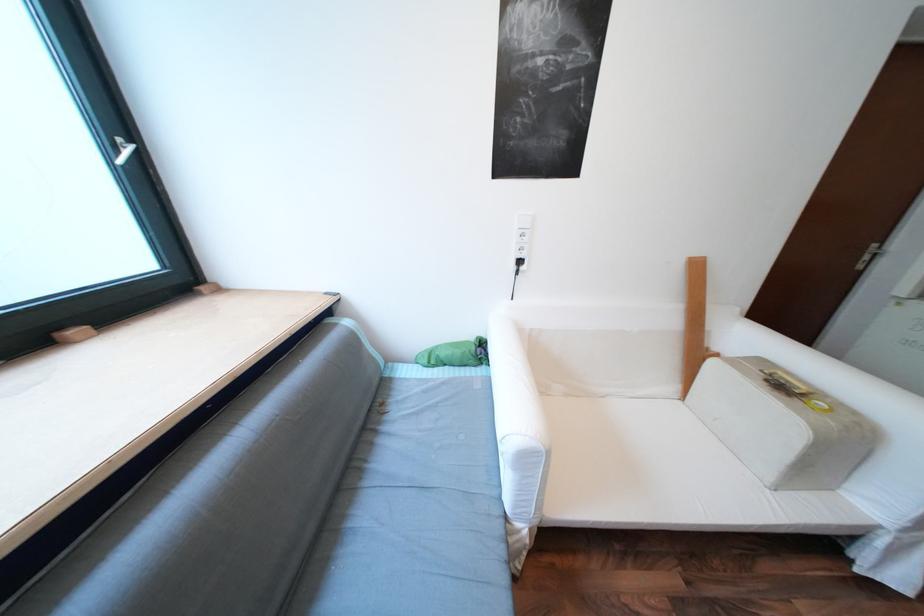
Find where to rest the white sofa armrest. Please return your answer as a coordinate pair (x, y).

(517, 422)